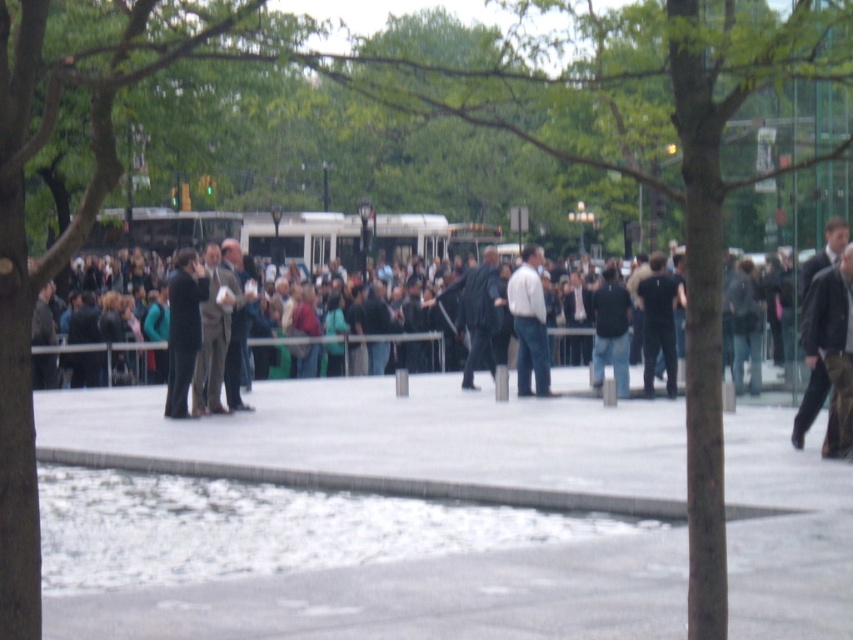
You are standing in the public square and notice a dark brown leather jacket at center. Where exactly is it positioned in terms of coordinates?

The dark brown leather jacket at center is located at point [833,348].

You are a photographer trying to capture a candid shot of the crowd in the public square. You notice two people wearing a dark brown leather jacket at center and a black matte shirt at center. Which clothing item is shorter in height?

The dark brown leather jacket at center is not as tall as the black matte shirt at center, so the dark brown leather jacket at center is shorter in height.